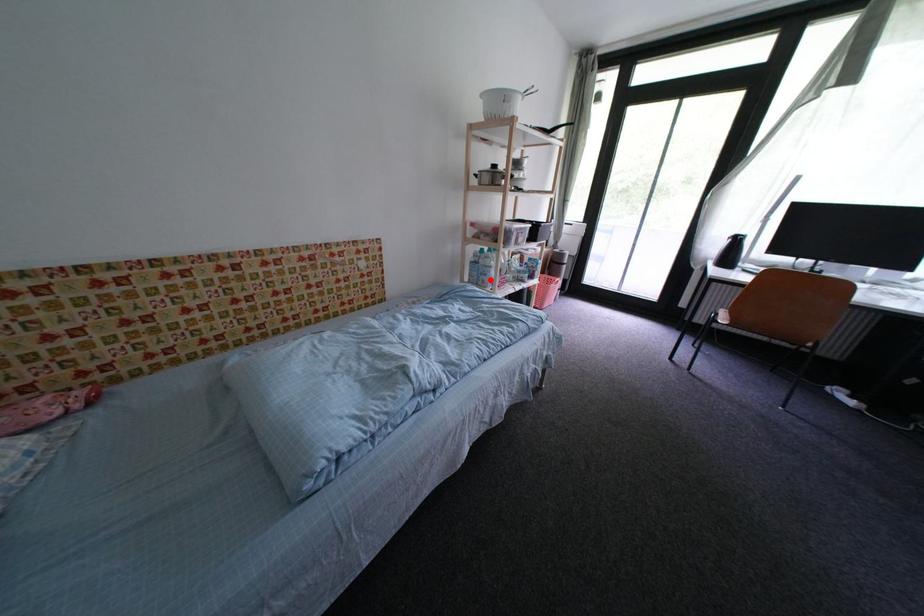
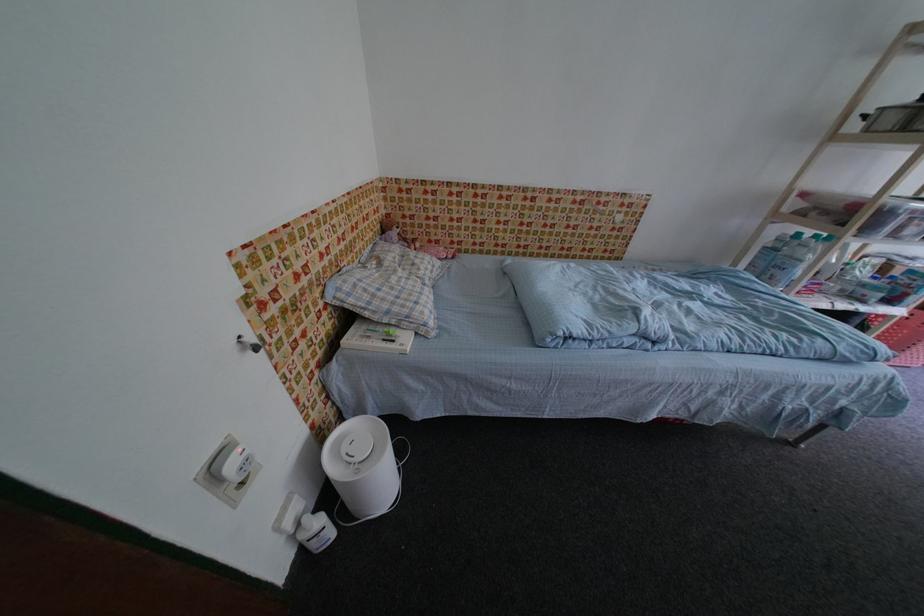
Question: A red point is marked in image1. In image2, is the corresponding 3D point closer to the camera or farther? Reply with the corresponding letter.

Choices:
 (A) The corresponding 3D point is closer.
 (B) The corresponding 3D point is farther.

Answer: (B)